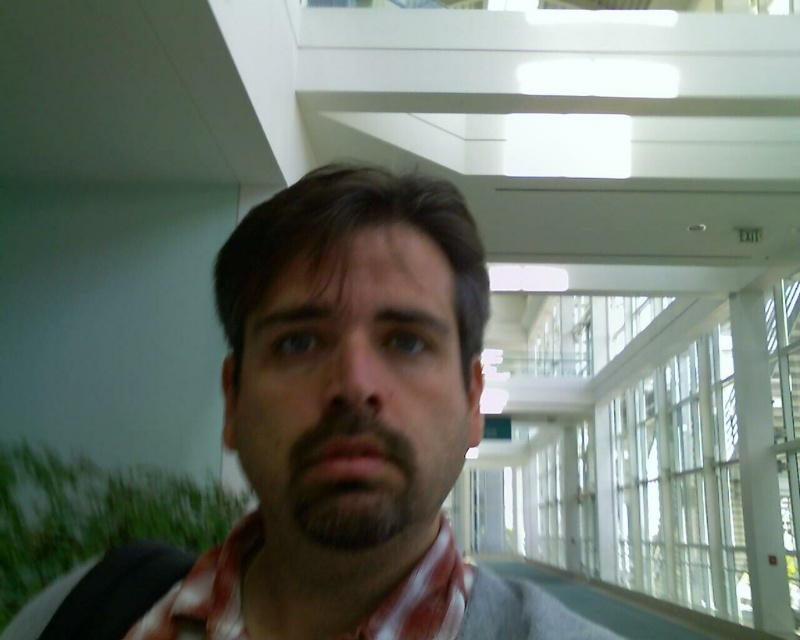
Can you confirm if matte gray shirt at center is positioned below red plaid scarf at center?

No.

Describe the element at coordinates (333, 436) in the screenshot. I see `matte gray shirt at center` at that location.

Does point (226, 561) lie behind point (408, 627)?

Yes.

Identify the location of matte gray shirt at center. (333, 436).

Which is above, matte gray shirt at center or dark brown fuzzy beard at center?

Positioned higher is matte gray shirt at center.

Does matte gray shirt at center come behind dark brown fuzzy beard at center?

That is False.

Looking at this image, who is more forward, (258, 557) or (348, 422)?

Positioned in front is point (348, 422).

You are a GUI agent. You are given a task and a screenshot of the screen. Output one action in this format:
    pyautogui.click(x=<x>, y=<y>)
    Task: Click on the matte gray shirt at center
    
    Given the screenshot: What is the action you would take?
    [x=333, y=436]

Does point (206, 568) come behind point (352, 426)?

Yes, point (206, 568) is behind point (352, 426).

How much distance is there between red plaid scarf at center and dark brown fuzzy beard at center?

A distance of 3.38 inches exists between red plaid scarf at center and dark brown fuzzy beard at center.

What do you see at coordinates (206, 593) in the screenshot?
I see `red plaid scarf at center` at bounding box center [206, 593].

Locate an element on the screen. red plaid scarf at center is located at coordinates (206, 593).